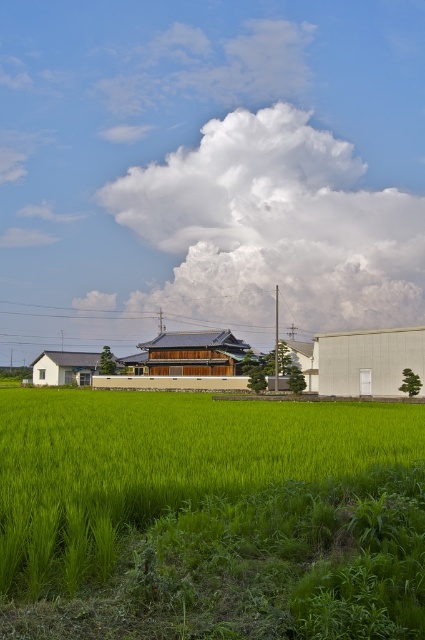
Question: Can you confirm if white fluffy cloud at upper center is smaller than green grassy field at center?

Choices:
 (A) no
 (B) yes

Answer: (A)

Question: Which object appears closest to the camera in this image?

Choices:
 (A) white fluffy cloud at upper center
 (B) green grassy field at center

Answer: (B)

Question: Among these points, which one is nearest to the camera?

Choices:
 (A) (110, 426)
 (B) (204, 216)

Answer: (A)

Question: Does white fluffy cloud at upper center have a lesser width compared to green grassy field at center?

Choices:
 (A) yes
 (B) no

Answer: (B)

Question: Can you confirm if white fluffy cloud at upper center is positioned to the left of green grassy field at center?

Choices:
 (A) yes
 (B) no

Answer: (B)

Question: Which object is closer to the camera taking this photo?

Choices:
 (A) white fluffy cloud at upper center
 (B) green grassy field at center

Answer: (B)